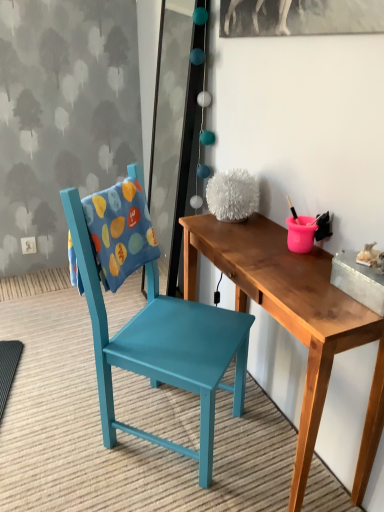
Image resolution: width=384 pixels, height=512 pixels. What are the coordinates of `free space to the left of teal painted wood chair at left` in the screenshot? It's located at (60, 426).